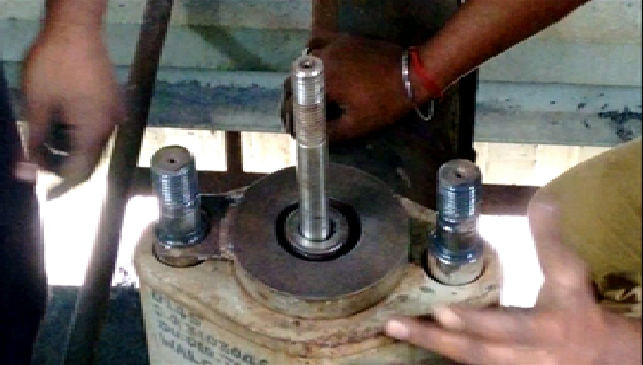
In order to click on light in this screenshot , I will do `click(511, 238)`.